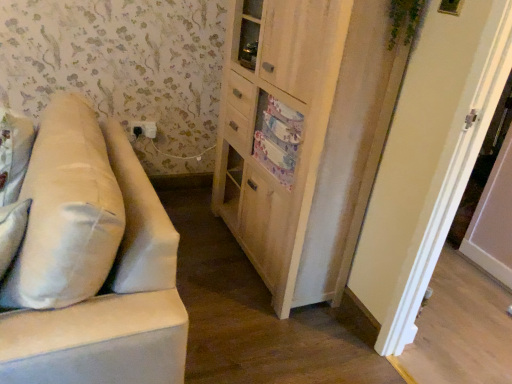
Question: Is beige fabric couch at left smaller than white fabric pillow at left?

Choices:
 (A) no
 (B) yes

Answer: (A)

Question: Is the position of beige fabric couch at left more distant than that of white fabric pillow at left?

Choices:
 (A) no
 (B) yes

Answer: (A)

Question: Considering the relative sizes of beige fabric couch at left and white fabric pillow at left in the image provided, is beige fabric couch at left wider than white fabric pillow at left?

Choices:
 (A) no
 (B) yes

Answer: (B)

Question: Does beige fabric couch at left have a lesser width compared to white fabric pillow at left?

Choices:
 (A) no
 (B) yes

Answer: (A)

Question: Considering the relative sizes of beige fabric couch at left and white fabric pillow at left in the image provided, is beige fabric couch at left shorter than white fabric pillow at left?

Choices:
 (A) no
 (B) yes

Answer: (A)

Question: Based on their positions, is wooden cabinet at center located to the left or right of black plastic outlet at upper left?

Choices:
 (A) left
 (B) right

Answer: (B)

Question: Considering the positions of point [270, 208] and point [131, 122], is point [270, 208] closer or farther from the camera than point [131, 122]?

Choices:
 (A) farther
 (B) closer

Answer: (B)

Question: Relative to black plastic outlet at upper left, is wooden cabinet at center in front or behind?

Choices:
 (A) front
 (B) behind

Answer: (A)

Question: From a real-world perspective, relative to black plastic outlet at upper left, is wooden cabinet at center vertically above or below?

Choices:
 (A) above
 (B) below

Answer: (A)

Question: Based on their positions, is beige fabric couch at left located to the left or right of white fabric pillow at left?

Choices:
 (A) left
 (B) right

Answer: (B)

Question: From the image's perspective, is beige fabric couch at left above or below white fabric pillow at left?

Choices:
 (A) above
 (B) below

Answer: (A)

Question: Choose the correct answer: Is beige fabric couch at left inside white fabric pillow at left or outside it?

Choices:
 (A) inside
 (B) outside

Answer: (B)

Question: Considering the positions of beige fabric couch at left and white fabric pillow at left in the image, is beige fabric couch at left taller or shorter than white fabric pillow at left?

Choices:
 (A) short
 (B) tall

Answer: (B)

Question: In the image, is beige fabric couch at left positioned in front of or behind black plastic outlet at upper left?

Choices:
 (A) behind
 (B) front

Answer: (B)

Question: Is beige fabric couch at left taller or shorter than black plastic outlet at upper left?

Choices:
 (A) tall
 (B) short

Answer: (A)